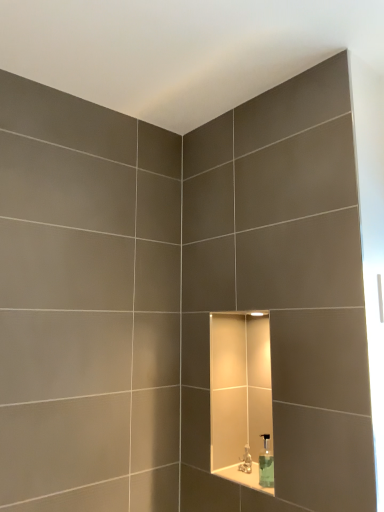
Question: Is clear glass soap dispenser at center behind white glossy ledge at center?

Choices:
 (A) no
 (B) yes

Answer: (B)

Question: From the image's perspective, is clear glass soap dispenser at center over white glossy ledge at center?

Choices:
 (A) yes
 (B) no

Answer: (A)

Question: Is clear glass soap dispenser at center to the right of white glossy ledge at center from the viewer's perspective?

Choices:
 (A) yes
 (B) no

Answer: (A)

Question: Considering the relative sizes of clear glass soap dispenser at center and white glossy ledge at center in the image provided, is clear glass soap dispenser at center smaller than white glossy ledge at center?

Choices:
 (A) yes
 (B) no

Answer: (B)

Question: Is clear glass soap dispenser at center positioned in front of white glossy ledge at center?

Choices:
 (A) no
 (B) yes

Answer: (A)

Question: Considering the relative positions of white glossy ledge at center and translucent plastic faucet at center in the image provided, is white glossy ledge at center to the left or to the right of translucent plastic faucet at center?

Choices:
 (A) left
 (B) right

Answer: (B)

Question: From a real-world perspective, relative to translucent plastic faucet at center, is white glossy ledge at center vertically above or below?

Choices:
 (A) below
 (B) above

Answer: (A)

Question: Is point (256, 484) positioned closer to the camera than point (248, 454)?

Choices:
 (A) farther
 (B) closer

Answer: (B)

Question: Would you say white glossy ledge at center is inside or outside translucent plastic faucet at center?

Choices:
 (A) inside
 (B) outside

Answer: (B)

Question: From the image's perspective, relative to clear glass soap dispenser at center, is translucent plastic faucet at center above or below?

Choices:
 (A) below
 (B) above

Answer: (A)

Question: Considering the positions of translucent plastic faucet at center and clear glass soap dispenser at center in the image, is translucent plastic faucet at center bigger or smaller than clear glass soap dispenser at center?

Choices:
 (A) big
 (B) small

Answer: (B)

Question: Is translucent plastic faucet at center to the left or to the right of clear glass soap dispenser at center in the image?

Choices:
 (A) left
 (B) right

Answer: (A)

Question: Looking at their shapes, would you say translucent plastic faucet at center is wider or thinner than clear glass soap dispenser at center?

Choices:
 (A) wide
 (B) thin

Answer: (B)

Question: Is point (251, 461) positioned closer to the camera than point (273, 488)?

Choices:
 (A) farther
 (B) closer

Answer: (A)

Question: Is translucent plastic faucet at center inside the boundaries of white glossy ledge at center, or outside?

Choices:
 (A) outside
 (B) inside

Answer: (A)